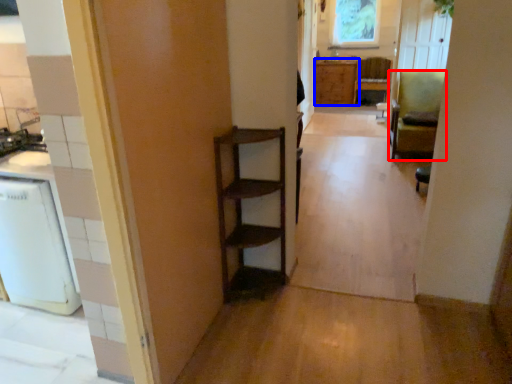
Question: Which of the following is the farthest to the observer, chair (highlighted by a red box) or cabinetry (highlighted by a blue box)?

Choices:
 (A) chair
 (B) cabinetry

Answer: (B)